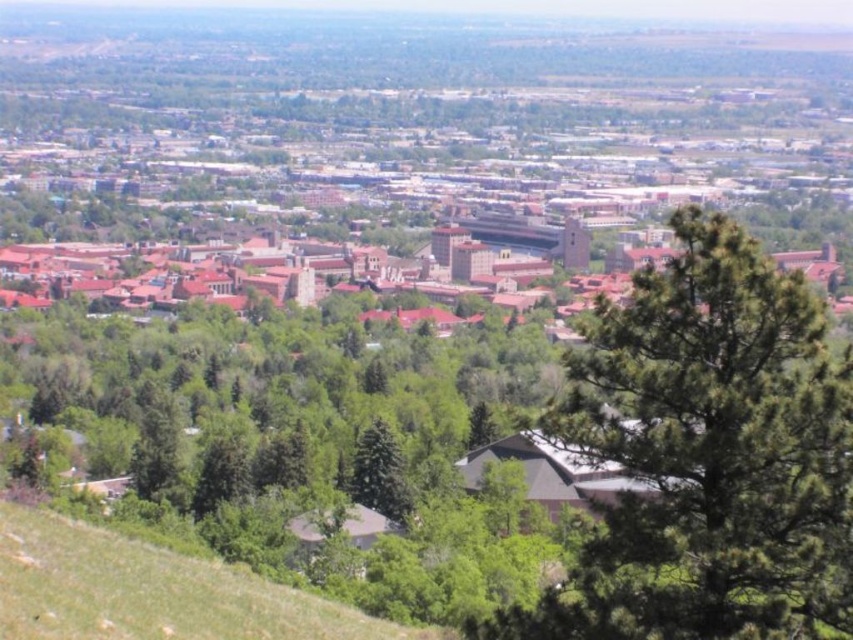
Question: Can you confirm if green leafy tree at center is smaller than green grassy hillside at lower left?

Choices:
 (A) no
 (B) yes

Answer: (A)

Question: Which is nearer to the green matte tree at center?

Choices:
 (A) green leafy tree at center
 (B) green grassy hillside at lower left

Answer: (B)

Question: Which is farther from the green grassy hillside at lower left?

Choices:
 (A) green matte tree at center
 (B) green leafy tree at center

Answer: (B)

Question: Can you confirm if green leafy tree at center is smaller than green grassy hillside at lower left?

Choices:
 (A) yes
 (B) no

Answer: (B)

Question: Which object is farther from the camera taking this photo?

Choices:
 (A) green grassy hillside at lower left
 (B) green matte tree at center
 (C) green leafy tree at center

Answer: (B)

Question: Is the position of green leafy tree at center less distant than that of green matte tree at center?

Choices:
 (A) yes
 (B) no

Answer: (A)